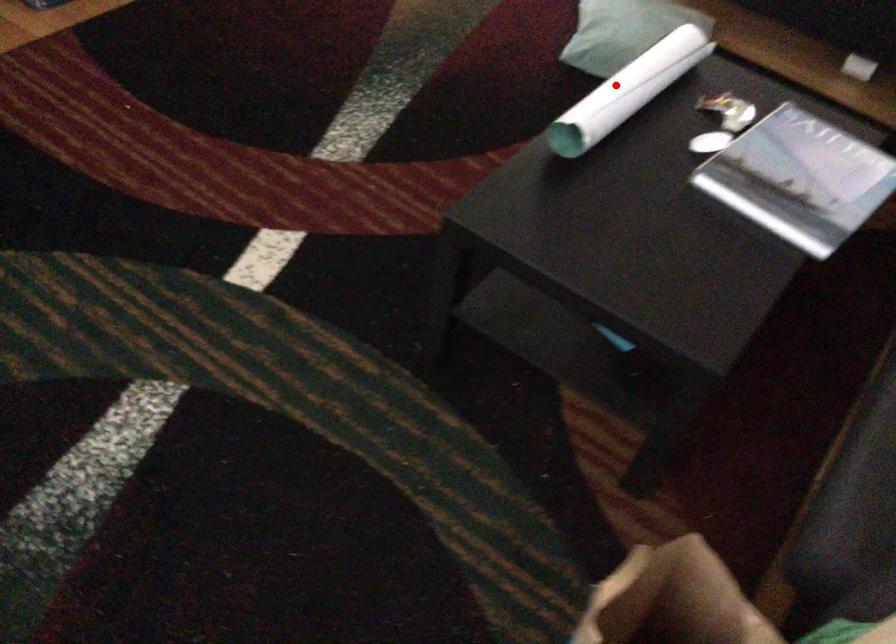
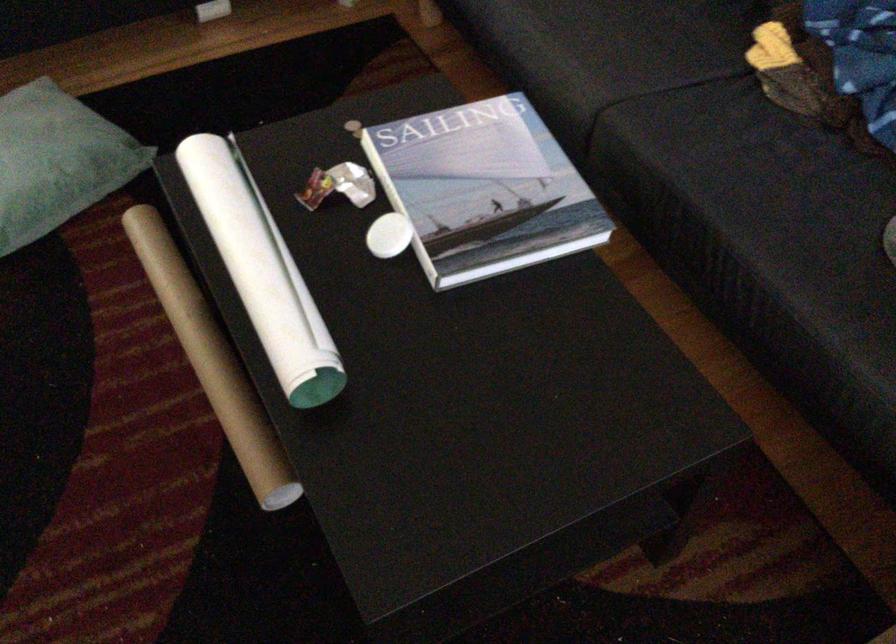
Find the pixel in the second image that matches the highlighted location in the first image.

(262, 270)